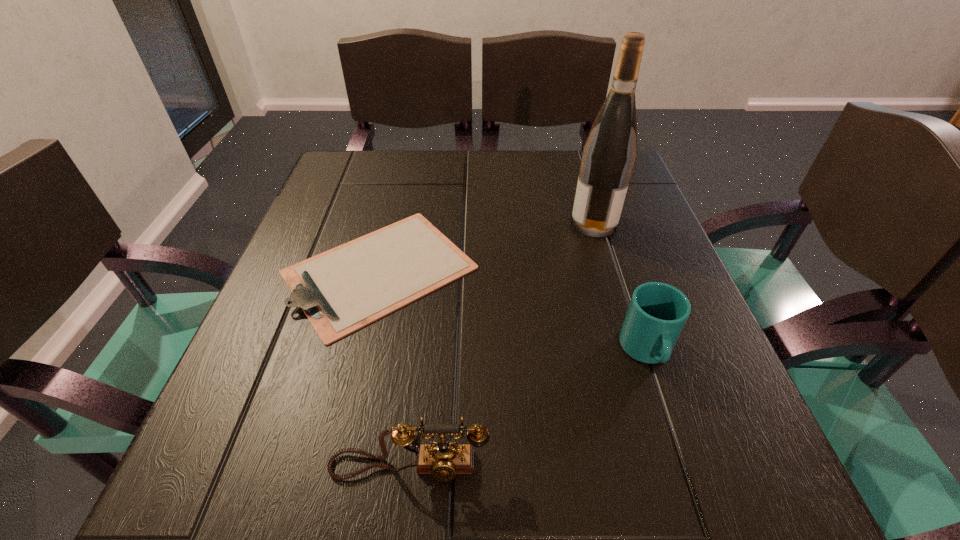
Where is `vacant area that lies between the tallest object and the shortest object`? The image size is (960, 540). vacant area that lies between the tallest object and the shortest object is located at coordinates (487, 246).

The image size is (960, 540). I want to click on empty location between the cup and the telephone, so click(528, 409).

Identify the location of vacant space in between the cup and the tallest object. The image size is (960, 540). (620, 287).

At what (x,y) coordinates should I click in order to perform the action: click on free space between the wine bottle and the clipboard. Please return your answer as a coordinate pair (x, y). Looking at the image, I should click on coord(487,246).

The height and width of the screenshot is (540, 960). In order to click on free spot between the tallest object and the cup in this screenshot , I will do `click(620, 287)`.

Find the location of a particular element. free space between the cup and the tallest object is located at coordinates (620, 287).

The width and height of the screenshot is (960, 540). What are the coordinates of `free space between the cup and the clipboard` in the screenshot? It's located at (513, 310).

Identify the location of vacant point located between the shortest object and the cup. (513, 310).

Point out which object is positioned as the nearest to the cup. Please provide its 2D coordinates. Your answer should be formatted as a tuple, i.e. [(x, y)], where the tuple contains the x and y coordinates of a point satisfying the conditions above.

[(341, 290)]

Choose which object is the nearest neighbor to the nearest object. Please provide its 2D coordinates. Your answer should be formatted as a tuple, i.e. [(x, y)], where the tuple contains the x and y coordinates of a point satisfying the conditions above.

[(341, 290)]